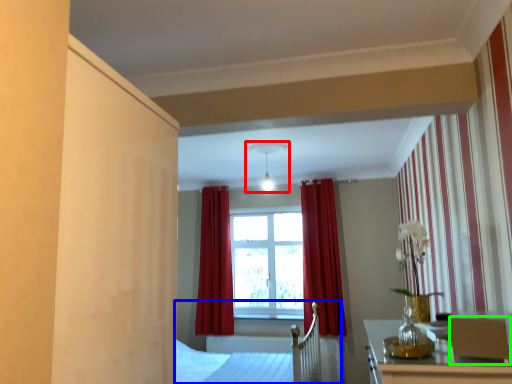
Question: Based on their relative distances, which object is farther from light fixture (highlighted by a red box)? Choose from bed frame (highlighted by a blue box) and armchair (highlighted by a green box).

Choices:
 (A) bed frame
 (B) armchair

Answer: (B)